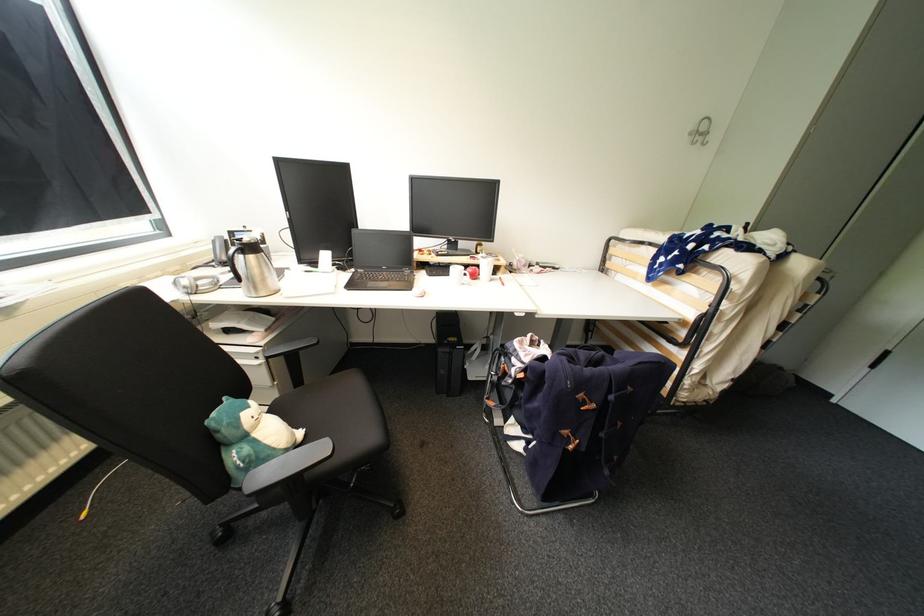
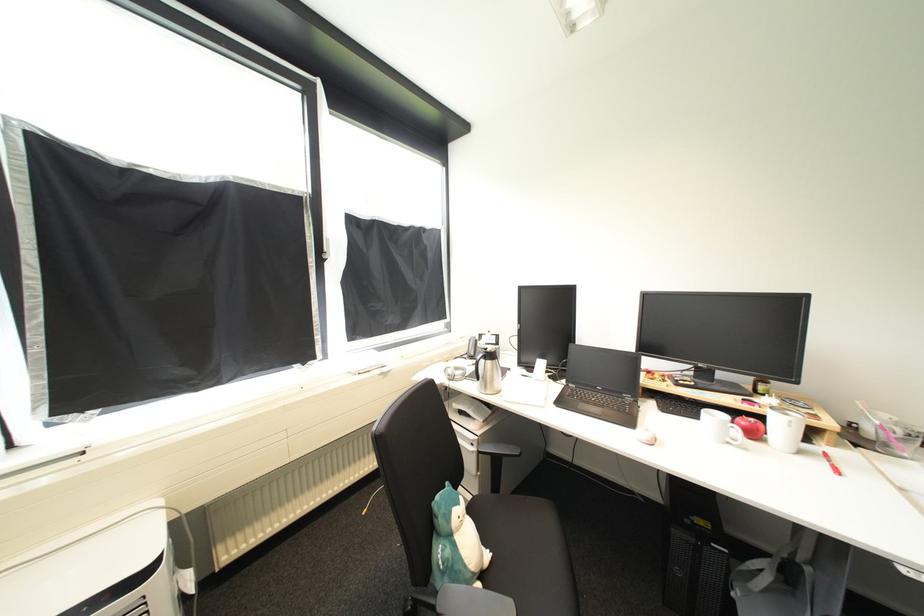
Where in the second image is the point corresponding to the point at 258,257 from the first image?

(495, 363)